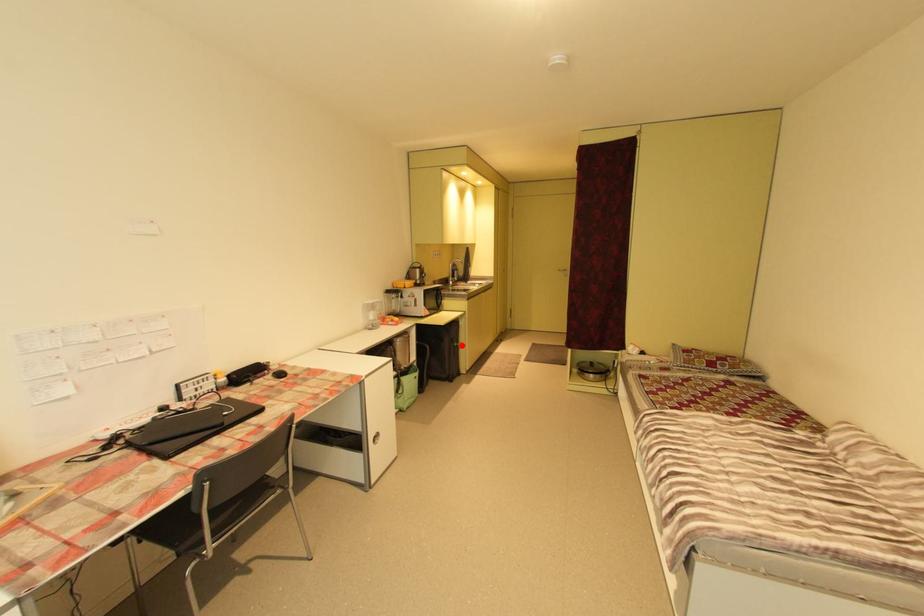
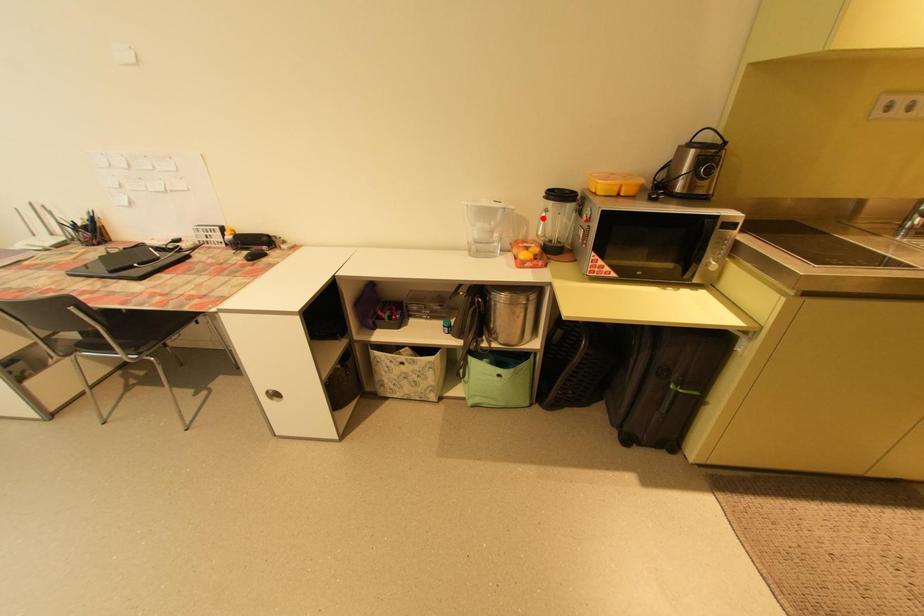
I am providing you with two images of the same scene from different viewpoints. A red point is marked on the first image and another point is marked on the second image. Does the point marked in image1 correspond to the same location as the one in image2?

No